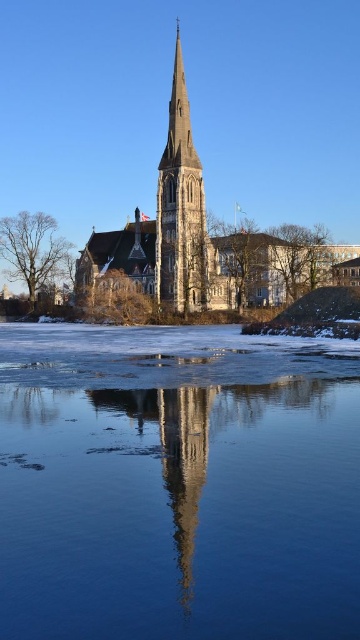
Question: Which point is farther from the camera taking this photo?

Choices:
 (A) (155, 602)
 (B) (325, 282)

Answer: (B)

Question: Which object appears farthest from the camera in this image?

Choices:
 (A) transparent ice at lower center
 (B) stone steeple at center
 (C) stone spire at center

Answer: (B)

Question: Is stone steeple at center to the right of stone spire at center from the viewer's perspective?

Choices:
 (A) yes
 (B) no

Answer: (A)

Question: Observing the image, what is the correct spatial positioning of transparent ice at lower center in reference to stone steeple at center?

Choices:
 (A) left
 (B) right

Answer: (A)

Question: Is stone steeple at center bigger than stone spire at center?

Choices:
 (A) yes
 (B) no

Answer: (A)

Question: Among these points, which one is farthest from the camera?

Choices:
 (A) (270, 600)
 (B) (168, 218)

Answer: (B)